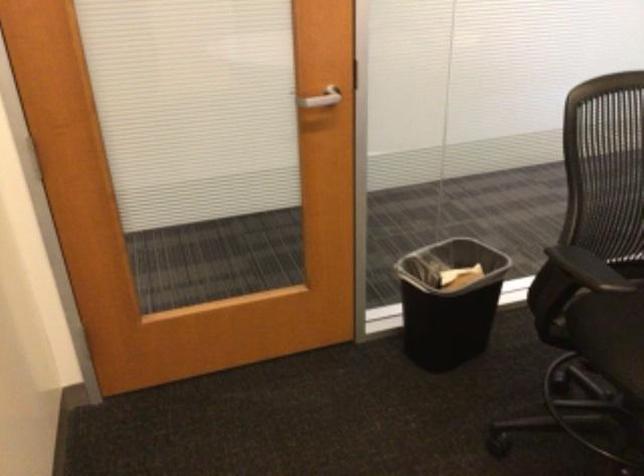
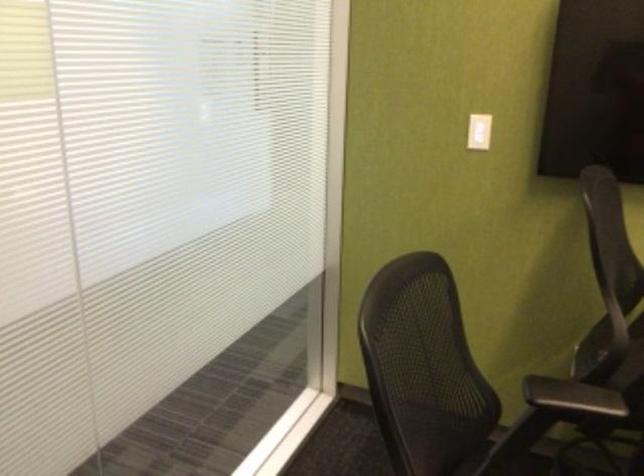
Question: The images are taken continuously from a first-person perspective. In which direction is your viewpoint rotating?

Choices:
 (A) Left
 (B) Right
 (C) Up
 (D) Down

Answer: (B)